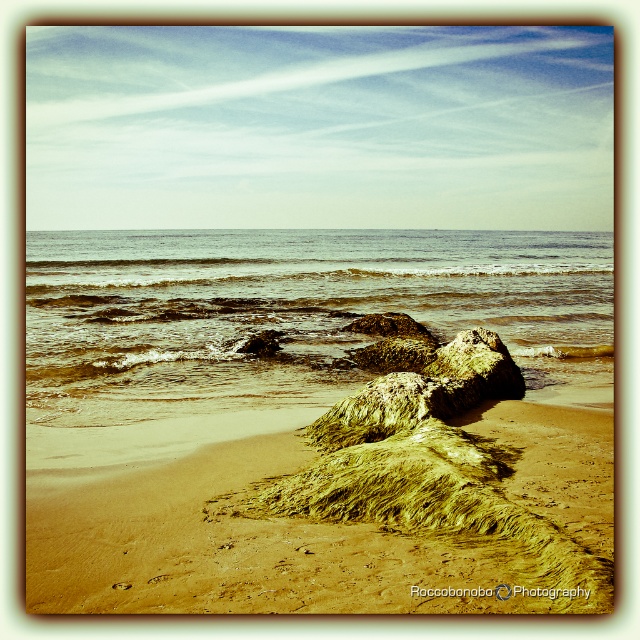
Question: Which point is farther to the camera?

Choices:
 (A) (280, 288)
 (B) (298, 481)

Answer: (A)

Question: Which point is farther to the camera?

Choices:
 (A) golden sandy beach at center
 (B) clear water at center

Answer: (B)

Question: In this image, where is golden sandy beach at center located relative to clear water at center?

Choices:
 (A) left
 (B) right

Answer: (B)

Question: Where is golden sandy beach at center located in relation to clear water at center in the image?

Choices:
 (A) right
 (B) left

Answer: (A)

Question: Is golden sandy beach at center thinner than clear water at center?

Choices:
 (A) yes
 (B) no

Answer: (A)

Question: Which object appears farthest from the camera in this image?

Choices:
 (A) golden sandy beach at center
 (B) clear water at center

Answer: (B)